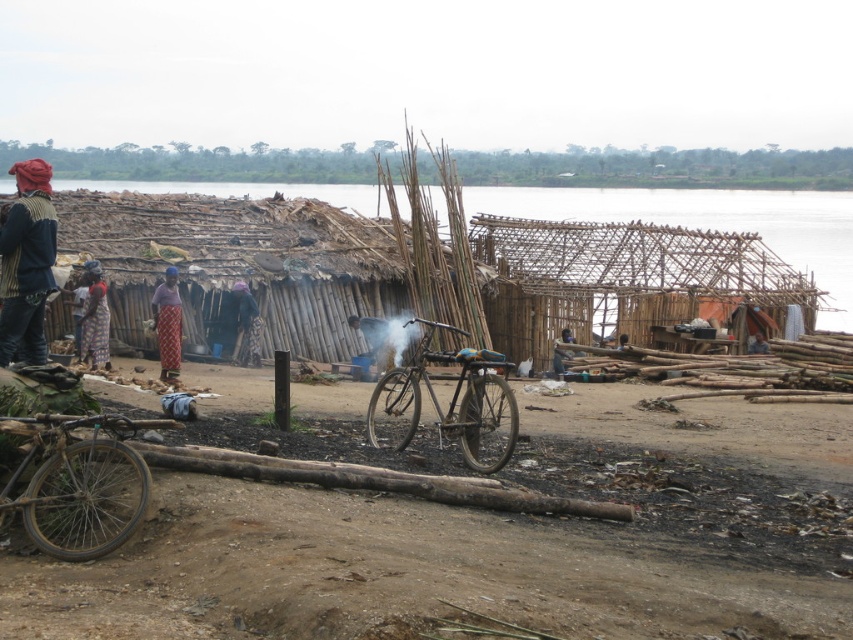
Question: Considering the relative positions of striped fabric headscarf at left and reddish-brown fabric at left in the image provided, where is striped fabric headscarf at left located with respect to reddish-brown fabric at left?

Choices:
 (A) below
 (B) above

Answer: (B)

Question: Can you confirm if rusty metal bicycle at center is smaller than reddish-brown fabric at left?

Choices:
 (A) no
 (B) yes

Answer: (B)

Question: Considering the real-world distances, which object is farthest from the rusty metal bicycle at center?

Choices:
 (A) striped fabric headscarf at left
 (B) rusty metal bicycle at lower left
 (C) dark blue fabric at center
 (D) matte purple blouse at center

Answer: (C)

Question: Can you confirm if rusty metal bicycle at center is smaller than matte purple blouse at center?

Choices:
 (A) no
 (B) yes

Answer: (B)

Question: Which object is the farthest from the reddish-brown fabric at left?

Choices:
 (A) striped fabric headscarf at left
 (B) light brown wooden stick at center

Answer: (B)

Question: Based on their relative distances, which object is farther from the rusty metal bicycle at center?

Choices:
 (A) brown dirt track at lower center
 (B) striped fabric headscarf at left
 (C) rusty metal bicycle at lower left
 (D) reddish-brown fabric at left

Answer: (D)